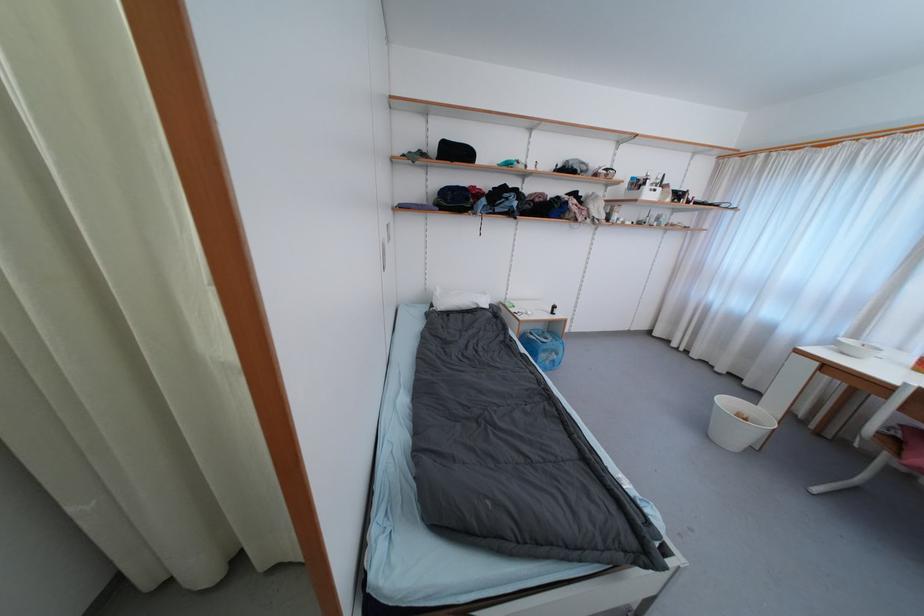
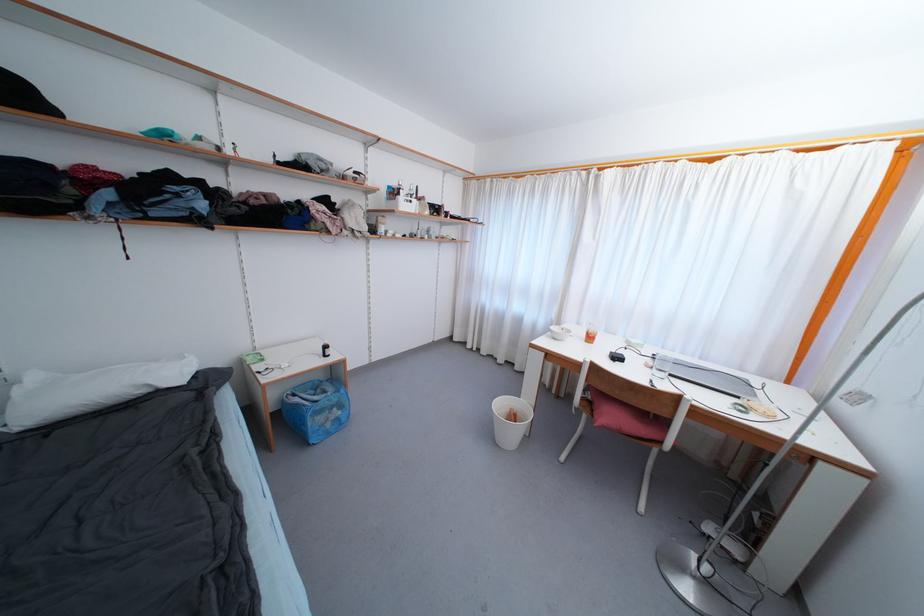
In the second image, find the point that corresponds to [732,405] in the first image.

(505, 407)